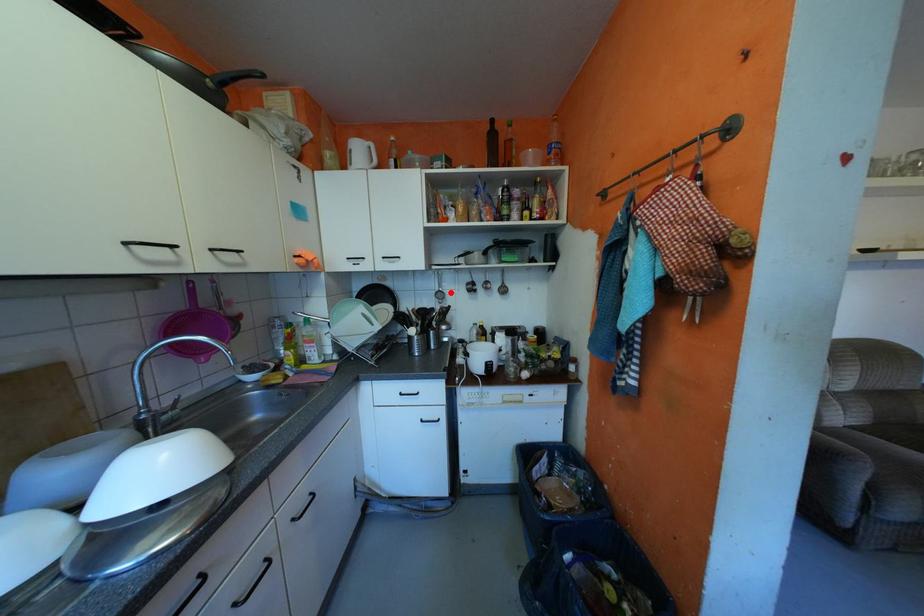
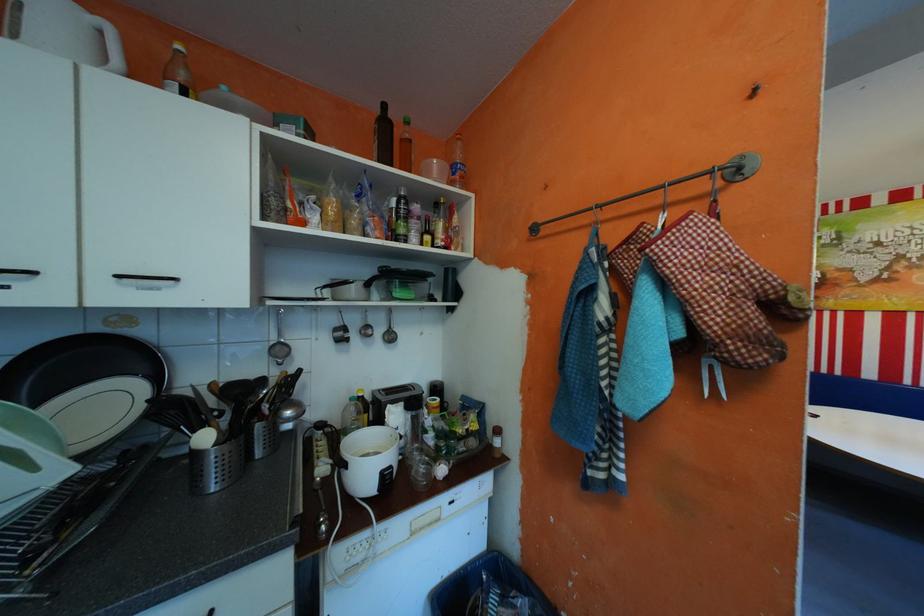
Locate, in the second image, the point that corresponds to the highlighted location in the first image.

(289, 346)